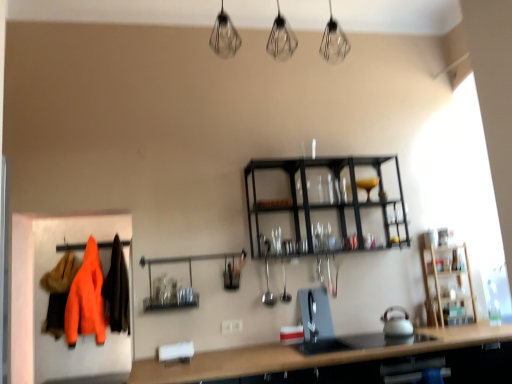
Question: Considering the relative sizes of metallic glassware at center and orange fabric coat at left in the image provided, is metallic glassware at center thinner than orange fabric coat at left?

Choices:
 (A) no
 (B) yes

Answer: (A)

Question: From the image's perspective, is metallic glassware at center on top of orange fabric coat at left?

Choices:
 (A) yes
 (B) no

Answer: (A)

Question: Does metallic glassware at center come behind orange fabric coat at left?

Choices:
 (A) no
 (B) yes

Answer: (A)

Question: Is metallic glassware at center at the left side of orange fabric coat at left?

Choices:
 (A) yes
 (B) no

Answer: (B)

Question: Considering the relative sizes of metallic glassware at center and orange fabric coat at left in the image provided, is metallic glassware at center wider than orange fabric coat at left?

Choices:
 (A) yes
 (B) no

Answer: (A)

Question: Is orange fabric coat at left surrounded by metallic glassware at center?

Choices:
 (A) no
 (B) yes

Answer: (A)

Question: Considering the relative sizes of orange fabric coat at left and metallic glassware at center in the image provided, is orange fabric coat at left thinner than metallic glassware at center?

Choices:
 (A) yes
 (B) no

Answer: (A)

Question: Considering the relative positions of orange fabric coat at left and metallic glassware at center in the image provided, is orange fabric coat at left behind metallic glassware at center?

Choices:
 (A) yes
 (B) no

Answer: (A)

Question: Does orange fabric coat at left have a lesser height compared to metallic glassware at center?

Choices:
 (A) no
 (B) yes

Answer: (A)

Question: Is orange fabric coat at left taller than metallic glassware at center?

Choices:
 (A) yes
 (B) no

Answer: (A)

Question: Can you confirm if orange fabric coat at left is positioned to the right of metallic glassware at center?

Choices:
 (A) yes
 (B) no

Answer: (B)

Question: Is orange fabric coat at left looking in the opposite direction of metallic glassware at center?

Choices:
 (A) yes
 (B) no

Answer: (B)

Question: Relative to metallic glassware at center, is orange fabric coat at left in front or behind?

Choices:
 (A) front
 (B) behind

Answer: (B)